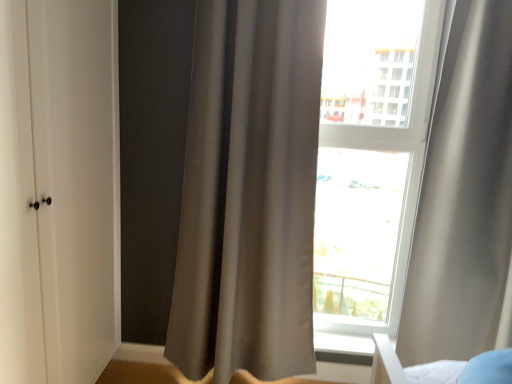
Where is `satin gray curtain at right, the first curtain viewed from the right`? This screenshot has width=512, height=384. satin gray curtain at right, the first curtain viewed from the right is located at coordinates (464, 195).

Where is `transparent glass window at center`? The image size is (512, 384). transparent glass window at center is located at coordinates (379, 177).

I want to click on white matte cabinet at left, so click(58, 190).

The width and height of the screenshot is (512, 384). In order to click on curtain on the right of transparent glass window at center in this screenshot , I will do `click(464, 195)`.

Is point (315, 329) farther from viewer compared to point (435, 100)?

Yes, it is.

From a real-world perspective, is transparent glass window at center over satin gray curtain at right, the first curtain viewed from the right?

Yes, from a real-world perspective, transparent glass window at center is on top of satin gray curtain at right, the first curtain viewed from the right.

From the image's perspective, between transparent glass window at center and satin gray curtain at right, arranged as the second curtain when viewed from the left, who is located below?

satin gray curtain at right, arranged as the second curtain when viewed from the left, appears lower in the image.

Does matte gray curtain at center, which is the first curtain from left to right, have a greater height compared to white matte cabinet at left?

Yes.

This screenshot has width=512, height=384. I want to click on screen door on the left of the matte gray curtain at center, which ranks as the 2th curtain in right-to-left order, so click(58, 190).

Are matte gray curtain at center, which is the first curtain from left to right, and white matte cabinet at left beside each other?

No.

Is point (204, 18) farther from camera compared to point (5, 225)?

Yes, it is behind point (5, 225).

From the image's perspective, is satin gray curtain at right, arranged as the second curtain when viewed from the left, on matte gray curtain at center, which is the first curtain from left to right?

No.

Which object is wider, satin gray curtain at right, arranged as the second curtain when viewed from the left, or matte gray curtain at center, which ranks as the 2th curtain in right-to-left order?

satin gray curtain at right, arranged as the second curtain when viewed from the left, is wider.

Does point (488, 69) come in front of point (249, 114)?

Yes, point (488, 69) is in front of point (249, 114).

Is matte gray curtain at center, which is the first curtain from left to right, surrounded by satin gray curtain at right, arranged as the second curtain when viewed from the left?

Actually, matte gray curtain at center, which is the first curtain from left to right, is outside satin gray curtain at right, arranged as the second curtain when viewed from the left.

Is matte gray curtain at center, which is the first curtain from left to right, facing away from satin gray curtain at right, the first curtain viewed from the right?

No, matte gray curtain at center, which is the first curtain from left to right,'s orientation is not away from satin gray curtain at right, the first curtain viewed from the right.

Locate an element on the screen. The width and height of the screenshot is (512, 384). curtain in front of the matte gray curtain at center, which ranks as the 2th curtain in right-to-left order is located at coordinates (464, 195).

From a real-world perspective, is matte gray curtain at center, which ranks as the 2th curtain in right-to-left order, positioned under satin gray curtain at right, the first curtain viewed from the right, based on gravity?

Indeed, from a real-world perspective, matte gray curtain at center, which ranks as the 2th curtain in right-to-left order, is positioned beneath satin gray curtain at right, the first curtain viewed from the right.

Is white matte cabinet at left to the right of transparent glass window at center from the viewer's perspective?

No.

Looking at this image, how many degrees apart are the facing directions of white matte cabinet at left and transparent glass window at center?

The facing directions of white matte cabinet at left and transparent glass window at center are 90.1 degrees apart.

Which is closer, (x=9, y=335) or (x=393, y=105)?

Point (x=9, y=335).

Is transparent glass window at center at the back of white matte cabinet at left?

No.

Is transparent glass window at center facing away from matte gray curtain at center, which ranks as the 2th curtain in right-to-left order?

No.

The height and width of the screenshot is (384, 512). Find the location of `window to the right of matte gray curtain at center, which ranks as the 2th curtain in right-to-left order`. window to the right of matte gray curtain at center, which ranks as the 2th curtain in right-to-left order is located at coordinates (379, 177).

Who is smaller, transparent glass window at center or matte gray curtain at center, which ranks as the 2th curtain in right-to-left order?

transparent glass window at center.

Is transparent glass window at center not close to matte gray curtain at center, which ranks as the 2th curtain in right-to-left order?

Absolutely, transparent glass window at center is distant from matte gray curtain at center, which ranks as the 2th curtain in right-to-left order.

From a real-world perspective, who is located higher, satin gray curtain at right, arranged as the second curtain when viewed from the left, or white matte cabinet at left?

In real-world perspective, satin gray curtain at right, arranged as the second curtain when viewed from the left, is above.

Considering the relative sizes of satin gray curtain at right, the first curtain viewed from the right, and white matte cabinet at left in the image provided, is satin gray curtain at right, the first curtain viewed from the right, smaller than white matte cabinet at left?

No.

Considering the relative sizes of satin gray curtain at right, the first curtain viewed from the right, and white matte cabinet at left in the image provided, is satin gray curtain at right, the first curtain viewed from the right, shorter than white matte cabinet at left?

Correct, satin gray curtain at right, the first curtain viewed from the right, is not as tall as white matte cabinet at left.

Identify the location of window behind the satin gray curtain at right, arranged as the second curtain when viewed from the left. (379, 177).

I want to click on screen door below the matte gray curtain at center, which is the first curtain from left to right (from the image's perspective), so click(x=58, y=190).

Considering their positions, is transparent glass window at center positioned closer to matte gray curtain at center, which ranks as the 2th curtain in right-to-left order, than satin gray curtain at right, the first curtain viewed from the right?

satin gray curtain at right, the first curtain viewed from the right, is positioned closer to the anchor matte gray curtain at center, which ranks as the 2th curtain in right-to-left order.

Estimate the real-world distances between objects in this image. Which object is further from satin gray curtain at right, arranged as the second curtain when viewed from the left, matte gray curtain at center, which is the first curtain from left to right, or white matte cabinet at left?

white matte cabinet at left lies further to satin gray curtain at right, arranged as the second curtain when viewed from the left, than the other object.

Estimate the real-world distances between objects in this image. Which object is closer to white matte cabinet at left, matte gray curtain at center, which ranks as the 2th curtain in right-to-left order, or satin gray curtain at right, the first curtain viewed from the right?

matte gray curtain at center, which ranks as the 2th curtain in right-to-left order, is positioned closer to the anchor white matte cabinet at left.

Estimate the real-world distances between objects in this image. Which object is closer to satin gray curtain at right, the first curtain viewed from the right, transparent glass window at center or matte gray curtain at center, which ranks as the 2th curtain in right-to-left order?

matte gray curtain at center, which ranks as the 2th curtain in right-to-left order.

Considering their positions, is satin gray curtain at right, the first curtain viewed from the right, positioned closer to transparent glass window at center than white matte cabinet at left?

satin gray curtain at right, the first curtain viewed from the right, lies closer to transparent glass window at center than the other object.

Based on the photo, from the image, which object appears to be nearer to transparent glass window at center, matte gray curtain at center, which ranks as the 2th curtain in right-to-left order, or white matte cabinet at left?

Based on the image, matte gray curtain at center, which ranks as the 2th curtain in right-to-left order, appears to be nearer to transparent glass window at center.

Considering their positions, is white matte cabinet at left positioned closer to matte gray curtain at center, which is the first curtain from left to right, than satin gray curtain at right, arranged as the second curtain when viewed from the left?

white matte cabinet at left is positioned closer to the anchor matte gray curtain at center, which is the first curtain from left to right.

When comparing their distances from transparent glass window at center, does matte gray curtain at center, which is the first curtain from left to right, or satin gray curtain at right, the first curtain viewed from the right, seem closer?

satin gray curtain at right, the first curtain viewed from the right, is closer to transparent glass window at center.

Identify the location of curtain located between white matte cabinet at left and transparent glass window at center in the left-right direction. (249, 192).

Where is `curtain located between white matte cabinet at left and satin gray curtain at right, arranged as the second curtain when viewed from the left, in the left-right direction`? curtain located between white matte cabinet at left and satin gray curtain at right, arranged as the second curtain when viewed from the left, in the left-right direction is located at coordinates coord(249,192).

Locate an element on the screen. Image resolution: width=512 pixels, height=384 pixels. window between matte gray curtain at center, which ranks as the 2th curtain in right-to-left order, and satin gray curtain at right, the first curtain viewed from the right, in the horizontal direction is located at coordinates (379, 177).

Identify the location of window situated between white matte cabinet at left and satin gray curtain at right, arranged as the second curtain when viewed from the left, from left to right. This screenshot has height=384, width=512. point(379,177).